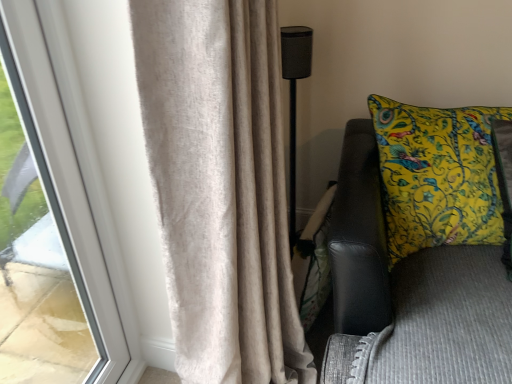
Question: Does yellow printed cushion at right have a larger size compared to beige textured curtain at left?

Choices:
 (A) yes
 (B) no

Answer: (B)

Question: Is yellow printed cushion at right surrounding beige textured curtain at left?

Choices:
 (A) no
 (B) yes

Answer: (A)

Question: From the image's perspective, is yellow printed cushion at right located beneath beige textured curtain at left?

Choices:
 (A) yes
 (B) no

Answer: (B)

Question: Is yellow printed cushion at right at the left side of beige textured curtain at left?

Choices:
 (A) no
 (B) yes

Answer: (A)

Question: Considering the relative positions of yellow printed cushion at right and beige textured curtain at left in the image provided, is yellow printed cushion at right to the right of beige textured curtain at left from the viewer's perspective?

Choices:
 (A) yes
 (B) no

Answer: (A)

Question: From the image's perspective, is yellow printed cushion at right above or below beige textured curtain at left?

Choices:
 (A) above
 (B) below

Answer: (A)

Question: Is point (454, 304) closer or farther from the camera than point (217, 165)?

Choices:
 (A) farther
 (B) closer

Answer: (A)

Question: In terms of height, does yellow printed cushion at right look taller or shorter compared to beige textured curtain at left?

Choices:
 (A) tall
 (B) short

Answer: (B)

Question: Based on their positions, is yellow printed cushion at right located to the left or right of beige textured curtain at left?

Choices:
 (A) left
 (B) right

Answer: (B)

Question: In terms of size, does beige textured curtain at left appear bigger or smaller than black mesh speaker at center?

Choices:
 (A) big
 (B) small

Answer: (A)

Question: From the image's perspective, is beige textured curtain at left above or below black mesh speaker at center?

Choices:
 (A) above
 (B) below

Answer: (B)

Question: Is beige textured curtain at left in front of or behind black mesh speaker at center in the image?

Choices:
 (A) front
 (B) behind

Answer: (A)

Question: From a real-world perspective, is beige textured curtain at left above or below black mesh speaker at center?

Choices:
 (A) below
 (B) above

Answer: (B)

Question: Considering the positions of point (248, 352) and point (366, 283), is point (248, 352) closer or farther from the camera than point (366, 283)?

Choices:
 (A) farther
 (B) closer

Answer: (A)

Question: Considering the positions of beige textured curtain at left and yellow printed cushion at right in the image, is beige textured curtain at left wider or thinner than yellow printed cushion at right?

Choices:
 (A) thin
 (B) wide

Answer: (B)